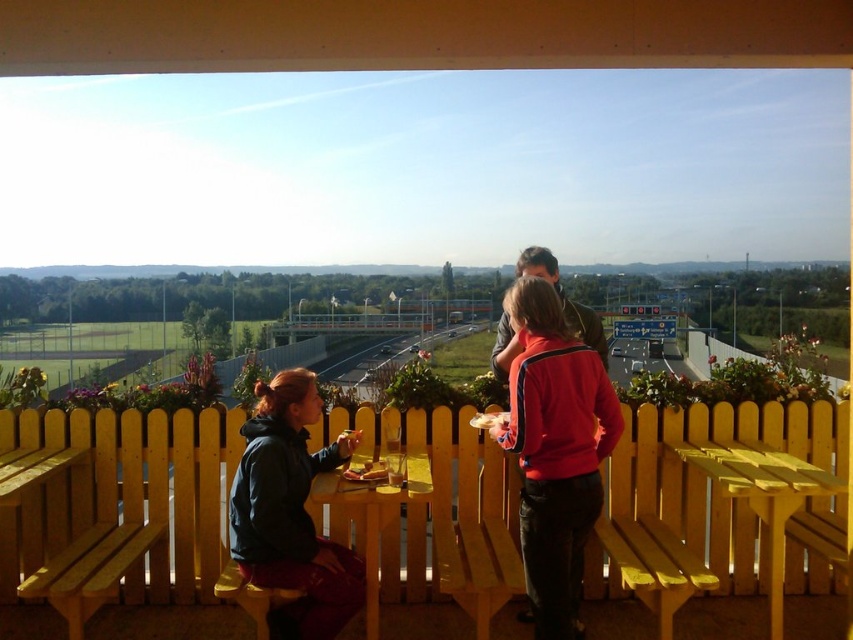
Question: Can you confirm if yellow wood bench at lower left is positioned to the left of yellow wooden picnic table at lower right?

Choices:
 (A) no
 (B) yes

Answer: (B)

Question: Based on their relative distances, which object is nearer to the yellow wood bench at lower left?

Choices:
 (A) wooden picnic table at center
 (B) dark blue jacket at lower left

Answer: (B)

Question: Does yellow wood bench at lower left appear on the right side of yellow wood bench at lower right?

Choices:
 (A) no
 (B) yes

Answer: (A)

Question: Considering the relative positions of yellow wood bench at lower left and yellow wood bench at lower right in the image provided, where is yellow wood bench at lower left located with respect to yellow wood bench at lower right?

Choices:
 (A) above
 (B) below

Answer: (A)

Question: Which point appears farthest from the camera in this image?

Choices:
 (A) (260, 435)
 (B) (376, 544)
 (C) (624, 564)

Answer: (B)

Question: Which of these objects is positioned closest to the red fleece jacket at center?

Choices:
 (A) yellow wood bench at lower right
 (B) yellow wooden picnic table at lower right
 (C) yellow wood bench at lower left

Answer: (A)